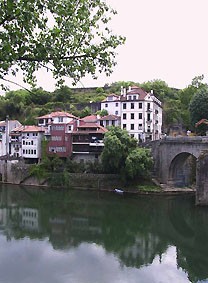
Identify the location of window. (140, 104).